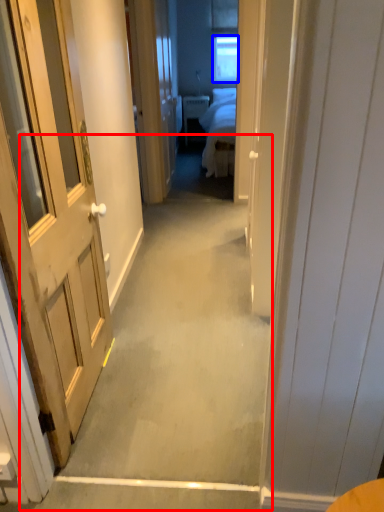
Question: Which of the following is the farthest to the observer, path (highlighted by a red box) or window (highlighted by a blue box)?

Choices:
 (A) path
 (B) window

Answer: (B)